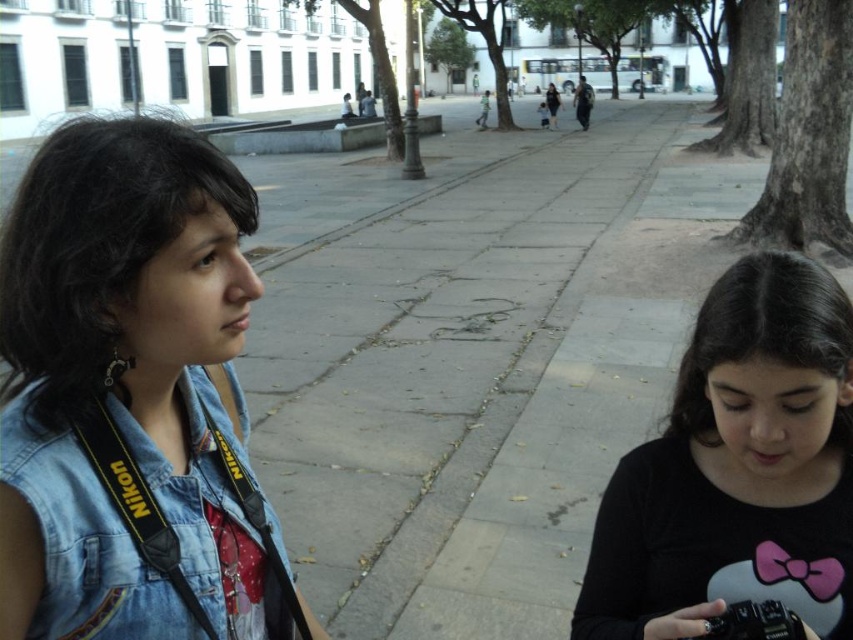
Based on the scene description, where is the black matte shirt at center located in relation to the denim jacket at lower left?

The black matte shirt at center is to the right of the denim jacket at lower left.